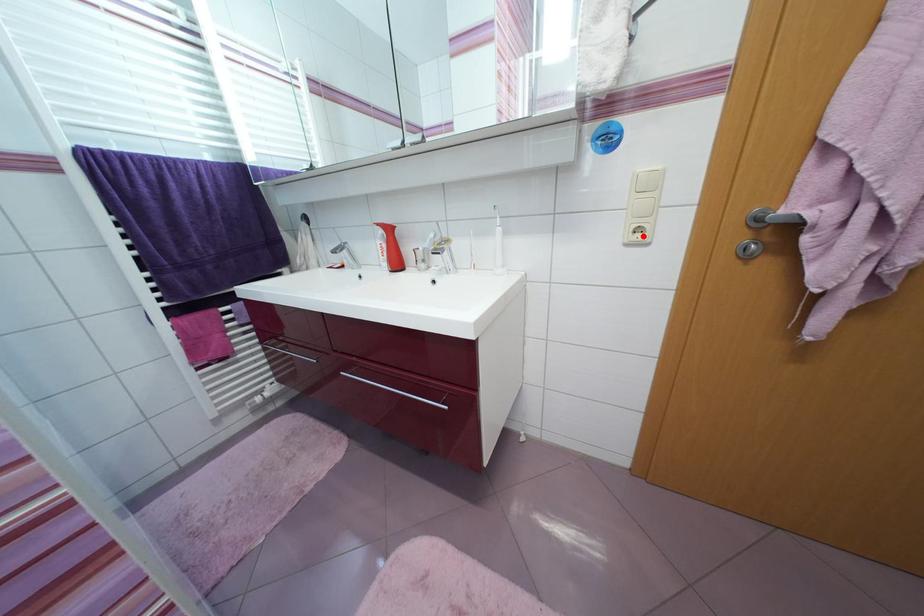
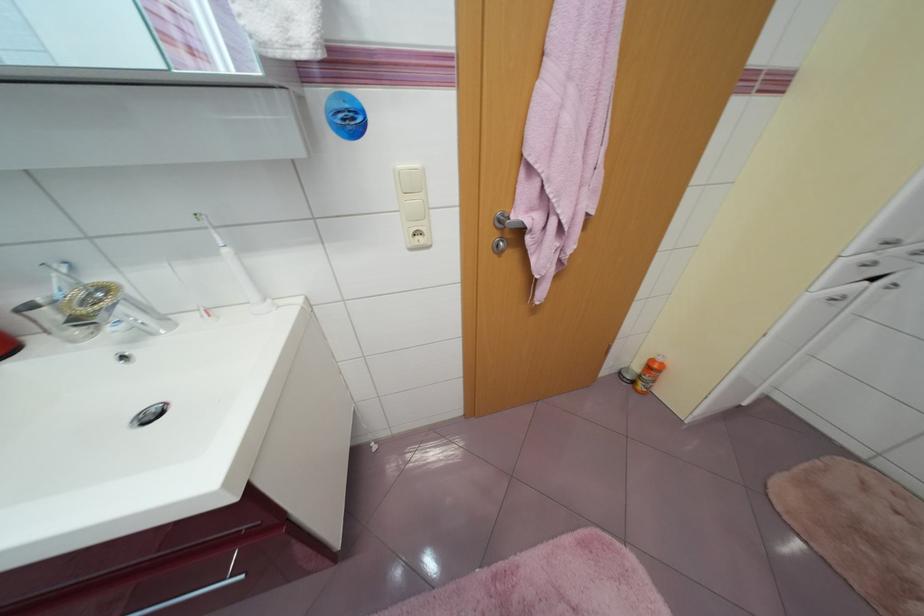
Where in the second image is the point corresponding to the highlighted location from the first image?

(423, 238)